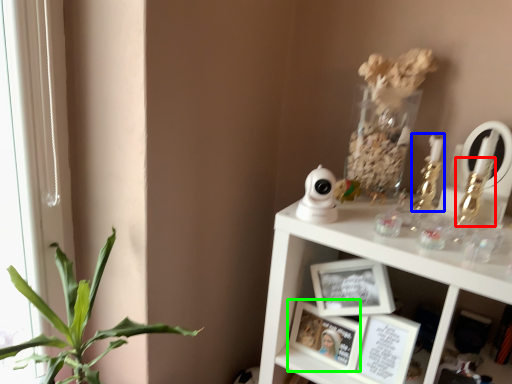
Question: Which object is the farthest from toy (highlighted by a red box)? Choose among these: candle holder (highlighted by a blue box) or picture frame (highlighted by a green box).

Choices:
 (A) candle holder
 (B) picture frame

Answer: (B)